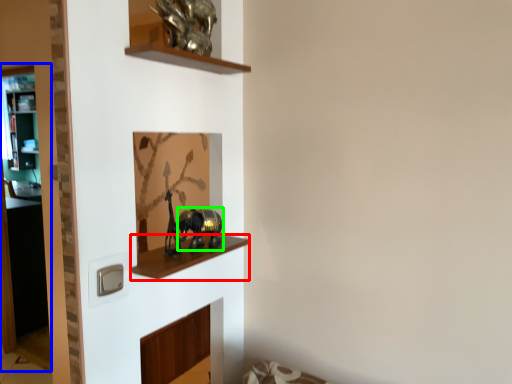
Question: Which object is positioned closest to cabinet (highlighted by a red box)? Select from glass door (highlighted by a blue box) and animal (highlighted by a green box).

Choices:
 (A) glass door
 (B) animal

Answer: (B)